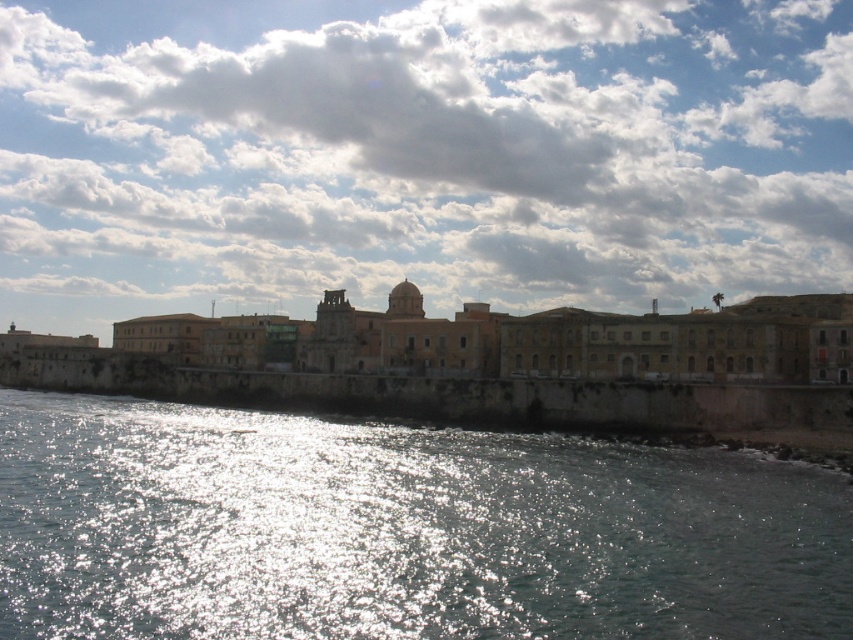
Based on the coordinates provided, which object in the scene corresponds to the point at (419,154)?

The cloudy sky at upper center corresponds to the point at (419,154).

You are an artist trying to paint the coastal scene. You need to decide which area to focus on first based on their sizes. Which object should you start with, the cloudy sky at upper center or the glistening water at lower left?

The cloudy sky at upper center is bigger than the glistening water at lower left, so you should start with the cloudy sky at upper center first.